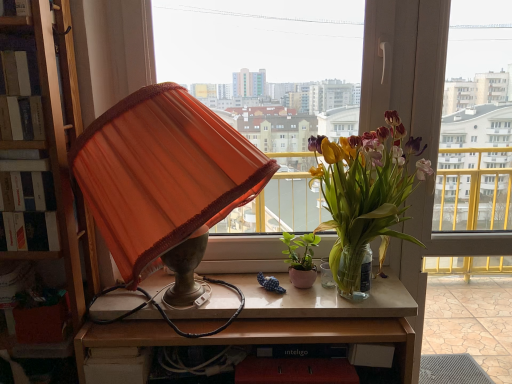
This screenshot has height=384, width=512. What do you see at coordinates (164, 182) in the screenshot? I see `orange fabric lampshade at left` at bounding box center [164, 182].

The width and height of the screenshot is (512, 384). In order to click on transparent glass window at center, the 2th window viewed from the left in this screenshot , I will do `click(476, 121)`.

How much space does transparent glass window at center, placed as the first window when sorted from right to left, occupy horizontally?

The width of transparent glass window at center, placed as the first window when sorted from right to left, is 7.27 inches.

The image size is (512, 384). I want to click on hardcover book at left, so click(x=27, y=202).

In order to face translucent glass vase at upper right, the 2th houseplant when ordered from left to right, should I rotate leftwards or rightwards?

To align with it, rotate right about 16.584°.

The width and height of the screenshot is (512, 384). What do you see at coordinates (301, 258) in the screenshot?
I see `green matte plant at center, arranged as the 2th houseplant when viewed from the right` at bounding box center [301, 258].

At what (x,y) coordinates should I click in order to perform the action: click on orange fabric lampshade at left. Please return your answer as a coordinate pair (x, y). This screenshot has height=384, width=512. Looking at the image, I should click on (164, 182).

From the image's perspective, who appears lower, hardcover book at left or transparent glass window at center, the 2th window viewed from the right?

hardcover book at left is shown below in the image.

What's the angular difference between hardcover book at left and transparent glass window at center, the 2th window viewed from the right,'s facing directions?

The angular difference between hardcover book at left and transparent glass window at center, the 2th window viewed from the right, is 0.319 degrees.

Does hardcover book at left have a greater height compared to transparent glass window at center, the 2th window viewed from the right?

No.

The width and height of the screenshot is (512, 384). In order to click on window positioned vertically above the hardcover book at left (from a real-world perspective) in this screenshot , I will do `click(269, 85)`.

Who is smaller, wooden table at center or transparent glass window at center, placed as the first window when sorted from left to right?

Smaller between the two is transparent glass window at center, placed as the first window when sorted from left to right.

Is wooden table at center located outside transparent glass window at center, placed as the first window when sorted from left to right?

wooden table at center is positioned outside transparent glass window at center, placed as the first window when sorted from left to right.

Can you confirm if wooden table at center is wider than transparent glass window at center, the 2th window viewed from the right?

Yes.

Is wooden table at center turned away from transparent glass window at center, placed as the first window when sorted from left to right?

That's not correct — wooden table at center is not looking away from transparent glass window at center, placed as the first window when sorted from left to right.

Is hardcover book at left inside the boundaries of translucent glass vase at upper right, the first houseplant viewed from the right, or outside?

hardcover book at left is located beyond the bounds of translucent glass vase at upper right, the first houseplant viewed from the right.

From a real-world perspective, does hardcover book at left sit lower than translucent glass vase at upper right, the 2th houseplant when ordered from left to right?

No, from a real-world perspective, hardcover book at left is not beneath translucent glass vase at upper right, the 2th houseplant when ordered from left to right.

From the picture: Is hardcover book at left facing away from translucent glass vase at upper right, the 2th houseplant when ordered from left to right?

No, hardcover book at left is not facing away from translucent glass vase at upper right, the 2th houseplant when ordered from left to right.

Considering the sizes of objects hardcover book at left and translucent glass vase at upper right, the first houseplant viewed from the right, in the image provided, who is taller, hardcover book at left or translucent glass vase at upper right, the first houseplant viewed from the right,?

translucent glass vase at upper right, the first houseplant viewed from the right, is taller.

Considering the relative sizes of orange fabric lampshade at left and transparent glass window at center, the 2th window viewed from the right, in the image provided, is orange fabric lampshade at left smaller than transparent glass window at center, the 2th window viewed from the right,?

Incorrect, orange fabric lampshade at left is not smaller in size than transparent glass window at center, the 2th window viewed from the right.

From the image's perspective, is orange fabric lampshade at left over transparent glass window at center, placed as the first window when sorted from left to right?

Incorrect, from the image's perspective, orange fabric lampshade at left is lower than transparent glass window at center, placed as the first window when sorted from left to right.

Is orange fabric lampshade at left oriented towards transparent glass window at center, placed as the first window when sorted from left to right?

No.

Are orange fabric lampshade at left and transparent glass window at center, the 2th window viewed from the right, beside each other?

orange fabric lampshade at left is not next to transparent glass window at center, the 2th window viewed from the right, and they're not touching.

Looking at this image, from a real-world perspective, is transparent glass window at center, placed as the first window when sorted from right to left, on top of transparent glass window at center, the 2th window viewed from the right?

Actually, transparent glass window at center, placed as the first window when sorted from right to left, is physically below transparent glass window at center, the 2th window viewed from the right, in the real world.

How much distance is there between transparent glass window at center, the 2th window viewed from the left, and transparent glass window at center, placed as the first window when sorted from left to right?

They are 28.71 inches apart.

At what (x,y) coordinates should I click in order to perform the action: click on window in front of the transparent glass window at center, placed as the first window when sorted from left to right. Please return your answer as a coordinate pair (x, y). Looking at the image, I should click on (476, 121).

Would you say transparent glass window at center, the 2th window viewed from the left, is to the left or to the right of transparent glass window at center, the 2th window viewed from the right, in the picture?

In the image, transparent glass window at center, the 2th window viewed from the left, appears on the right side of transparent glass window at center, the 2th window viewed from the right.

From a real-world perspective, is translucent glass vase at upper right, the first houseplant viewed from the right, above or below green matte plant at center, arranged as the 2th houseplant when viewed from the right?

translucent glass vase at upper right, the first houseplant viewed from the right, is above green matte plant at center, arranged as the 2th houseplant when viewed from the right.

Is point (335, 177) positioned after point (294, 279)?

No, (335, 177) is closer to viewer.

Is translucent glass vase at upper right, the 2th houseplant when ordered from left to right, in contact with green matte plant at center, arranged as the 2th houseplant when viewed from the right?

No, translucent glass vase at upper right, the 2th houseplant when ordered from left to right, is not next to green matte plant at center, arranged as the 2th houseplant when viewed from the right.

At what (x,y) coordinates should I click in order to perform the action: click on houseplant in front of the green matte plant at center, acting as the 1th houseplant starting from the left. Please return your answer as a coordinate pair (x, y). The image size is (512, 384). Looking at the image, I should click on point(366,193).

Measure the distance between green matte plant at center, arranged as the 2th houseplant when viewed from the right, and orange fabric lampshade at left.

The distance of green matte plant at center, arranged as the 2th houseplant when viewed from the right, from orange fabric lampshade at left is 19.35 inches.

Could you tell me if green matte plant at center, arranged as the 2th houseplant when viewed from the right, is facing orange fabric lampshade at left?

No, green matte plant at center, arranged as the 2th houseplant when viewed from the right, is not facing towards orange fabric lampshade at left.

Between green matte plant at center, acting as the 1th houseplant starting from the left, and orange fabric lampshade at left, which one is positioned behind?

green matte plant at center, acting as the 1th houseplant starting from the left, is more distant.

Does green matte plant at center, acting as the 1th houseplant starting from the left, have a larger size compared to orange fabric lampshade at left?

No.

You are a GUI agent. You are given a task and a screenshot of the screen. Output one action in this format:
    pyautogui.click(x=<x>, y=<y>)
    Task: Click on the book lying below the transparent glass window at center, placed as the first window when sorted from left to right (from the image's perspective)
    Image resolution: width=512 pixels, height=384 pixels.
    Given the screenshot: What is the action you would take?
    pyautogui.click(x=27, y=202)

The width and height of the screenshot is (512, 384). What are the coordinates of `the 2nd window behind the wooden table at center, counting from the anchor's position` in the screenshot? It's located at (269, 85).

Considering their positions, is transparent glass window at center, placed as the first window when sorted from right to left, positioned further to orange fabric lampshade at left than translucent glass vase at upper right, the 2th houseplant when ordered from left to right?

The object further to orange fabric lampshade at left is transparent glass window at center, placed as the first window when sorted from right to left.

From the picture: Estimate the real-world distances between objects in this image. Which object is further from wooden table at center, orange fabric lampshade at left or transparent glass window at center, the 2th window viewed from the right?

A: transparent glass window at center, the 2th window viewed from the right, is positioned further to the anchor wooden table at center.

Considering their positions, is transparent glass window at center, placed as the first window when sorted from left to right, positioned further to green matte plant at center, arranged as the 2th houseplant when viewed from the right, than wooden table at center?

Based on the image, transparent glass window at center, placed as the first window when sorted from left to right, appears to be further to green matte plant at center, arranged as the 2th houseplant when viewed from the right.

Estimate the real-world distances between objects in this image. Which object is closer to transparent glass window at center, placed as the first window when sorted from left to right, translucent glass vase at upper right, the 2th houseplant when ordered from left to right, or green matte plant at center, acting as the 1th houseplant starting from the left?

translucent glass vase at upper right, the 2th houseplant when ordered from left to right, is closer to transparent glass window at center, placed as the first window when sorted from left to right.

Based on their spatial positions, is translucent glass vase at upper right, the first houseplant viewed from the right, or hardcover book at left further from transparent glass window at center, the 2th window viewed from the right?

Among the two, hardcover book at left is located further to transparent glass window at center, the 2th window viewed from the right.

Estimate the real-world distances between objects in this image. Which object is further from transparent glass window at center, the 2th window viewed from the right, transparent glass window at center, placed as the first window when sorted from right to left, or hardcover book at left?

hardcover book at left.

From the image, which object appears to be farther from transparent glass window at center, the 2th window viewed from the right, green matte plant at center, acting as the 1th houseplant starting from the left, or hardcover book at left?

Among the two, hardcover book at left is located further to transparent glass window at center, the 2th window viewed from the right.

From the image, which object appears to be farther from orange fabric lampshade at left, hardcover book at left or transparent glass window at center, the 2th window viewed from the left?

transparent glass window at center, the 2th window viewed from the left, lies further to orange fabric lampshade at left than the other object.

The image size is (512, 384). I want to click on table between orange fabric lampshade at left and translucent glass vase at upper right, the 2th houseplant when ordered from left to right, from left to right, so click(x=272, y=322).

Identify the location of table between orange fabric lampshade at left and transparent glass window at center, placed as the first window when sorted from right to left. The width and height of the screenshot is (512, 384). (272, 322).

Locate an element on the screen. The height and width of the screenshot is (384, 512). table between hardcover book at left and transparent glass window at center, placed as the first window when sorted from right to left, from left to right is located at coordinates (272, 322).

Locate an element on the screen. table situated between hardcover book at left and translucent glass vase at upper right, the 2th houseplant when ordered from left to right, from left to right is located at coordinates (272, 322).